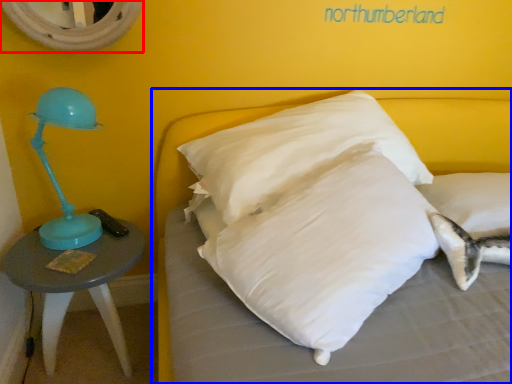
Question: Among these objects, which one is farthest to the camera, mirror (highlighted by a red box) or bed (highlighted by a blue box)?

Choices:
 (A) mirror
 (B) bed

Answer: (A)